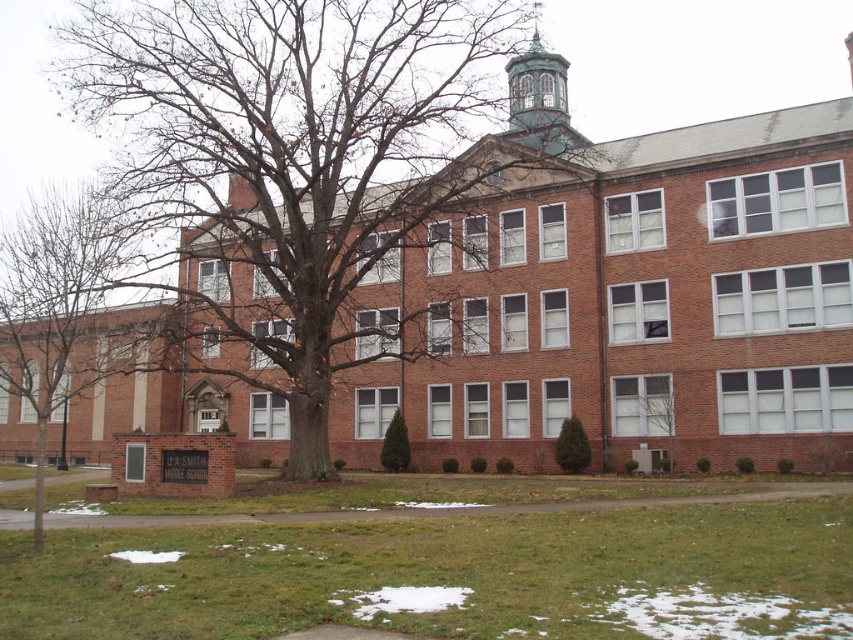
Is the position of bare wood tree at left less distant than that of green leafy tree at center?

That is True.

Is bare wood tree at left taller than green leafy tree at center?

Indeed, bare wood tree at left has a greater height compared to green leafy tree at center.

This screenshot has width=853, height=640. I want to click on bare wood tree at left, so click(67, 308).

Who is lower down, green copper bell tower at upper center or green leafy tree at center?

green leafy tree at center is lower down.

Does green copper bell tower at upper center have a lesser height compared to green leafy tree at center?

No, green copper bell tower at upper center is not shorter than green leafy tree at center.

Locate an element on the screen. Image resolution: width=853 pixels, height=640 pixels. green copper bell tower at upper center is located at coordinates (538, 100).

Looking at this image, does green leafy tree at center have a larger size compared to green textured evergreen at center?

No, green leafy tree at center is not bigger than green textured evergreen at center.

Can you confirm if green leafy tree at center is wider than green textured evergreen at center?

In fact, green leafy tree at center might be narrower than green textured evergreen at center.

Locate an element on the screen. green leafy tree at center is located at coordinates (657, 413).

Image resolution: width=853 pixels, height=640 pixels. Find the location of `green leafy tree at center`. green leafy tree at center is located at coordinates (657, 413).